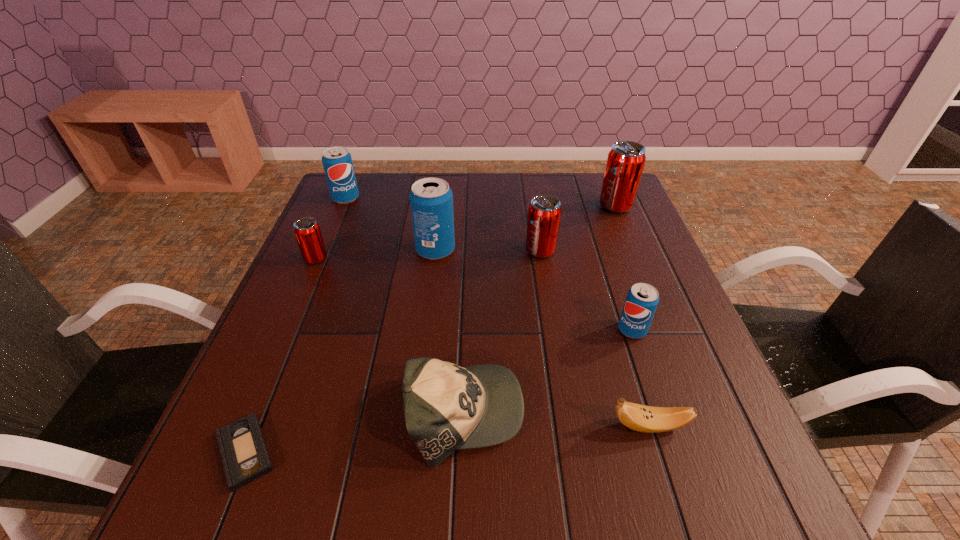
Image resolution: width=960 pixels, height=540 pixels. Identify the location of the third soda can from left to right. [431, 200].

Locate an element on the screen. The height and width of the screenshot is (540, 960). the second blue soda can from left to right is located at coordinates (431, 200).

The image size is (960, 540). Find the location of `the rightmost red soda can`. the rightmost red soda can is located at coordinates (625, 163).

This screenshot has width=960, height=540. In order to click on the biggest red soda can in this screenshot , I will do `click(625, 163)`.

I want to click on the farthest blue soda can, so click(337, 162).

Where is `the leftmost blue soda can`? Image resolution: width=960 pixels, height=540 pixels. the leftmost blue soda can is located at coordinates coord(337,162).

At what (x,y) coordinates should I click in order to perform the action: click on the third soda can from right to left. Please return your answer as a coordinate pair (x, y). Image resolution: width=960 pixels, height=540 pixels. Looking at the image, I should click on (544, 213).

Where is `the sixth object from left to right`? the sixth object from left to right is located at coordinates (544, 213).

This screenshot has width=960, height=540. I want to click on the leftmost red soda can, so click(307, 231).

Locate an element on the screen. the rightmost blue soda can is located at coordinates (642, 299).